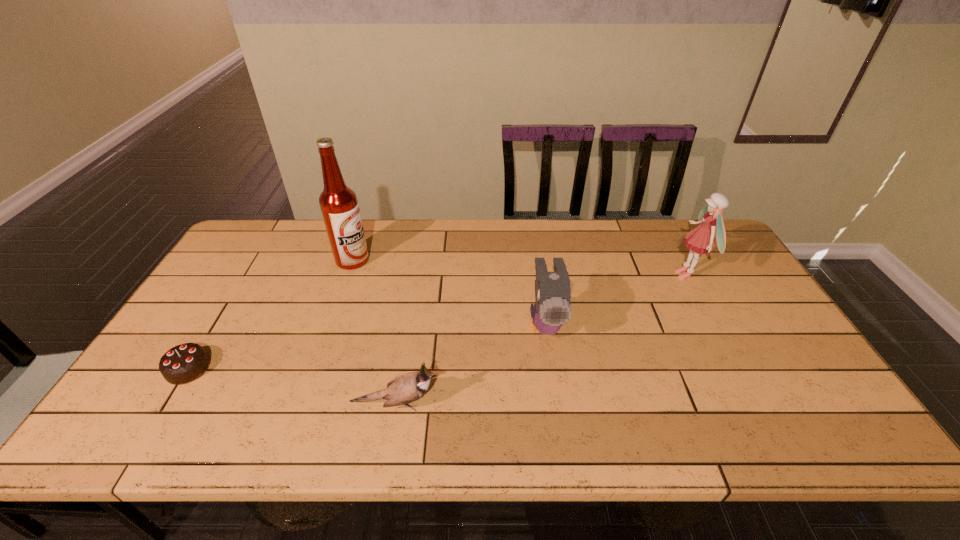
You are a GUI agent. You are given a task and a screenshot of the screen. Output one action in this format:
    pyautogui.click(x=<x>, y=<y>)
    Task: Click on the free spot located on the label side of the alcohol
    The height and width of the screenshot is (540, 960).
    Given the screenshot: What is the action you would take?
    pyautogui.click(x=431, y=260)

The width and height of the screenshot is (960, 540). Identify the location of vacant region located 0.230m on the front-facing side of the rightmost object. (599, 275).

You are a GUI agent. You are given a task and a screenshot of the screen. Output one action in this format:
    pyautogui.click(x=<x>, y=<y>)
    Task: Click on the free location located on the front-facing side of the rightmost object
    
    Given the screenshot: What is the action you would take?
    pyautogui.click(x=603, y=275)

Find the location of a particular element. vacant point located 0.370m on the front-facing side of the rightmost object is located at coordinates (554, 275).

Image resolution: width=960 pixels, height=540 pixels. I want to click on vacant space located at the beak of the fourth object from left to right, so click(555, 389).

Where is `blank space located at the face of the left bird`? blank space located at the face of the left bird is located at coordinates (497, 404).

I want to click on free space located 0.110m on the right of the leftmost object, so click(x=252, y=369).

Where is `alcohol at the far edge`? Image resolution: width=960 pixels, height=540 pixels. alcohol at the far edge is located at coordinates (339, 205).

This screenshot has height=540, width=960. I want to click on doll situated at the far edge, so click(701, 239).

Locate an element on the screen. The height and width of the screenshot is (540, 960). object that is at the near edge is located at coordinates [404, 389].